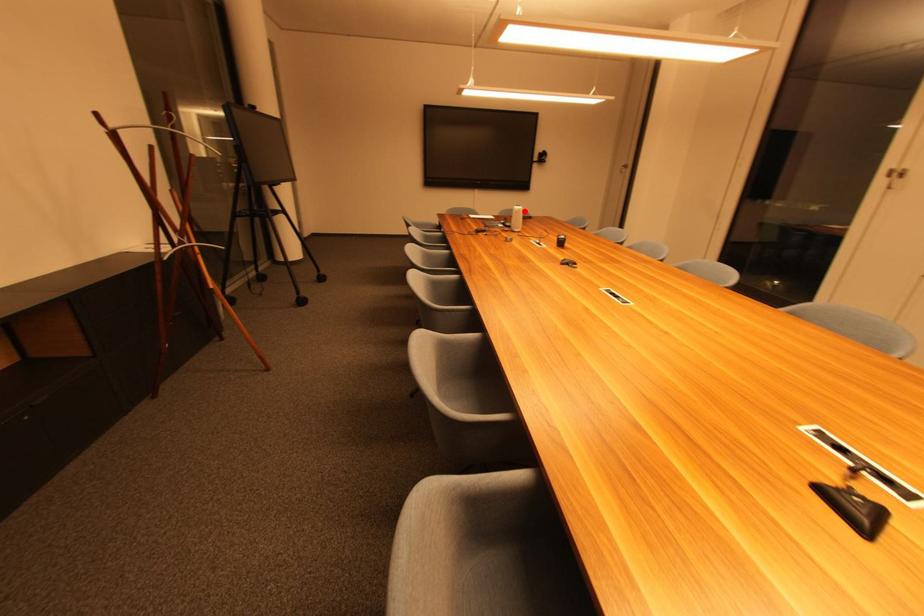
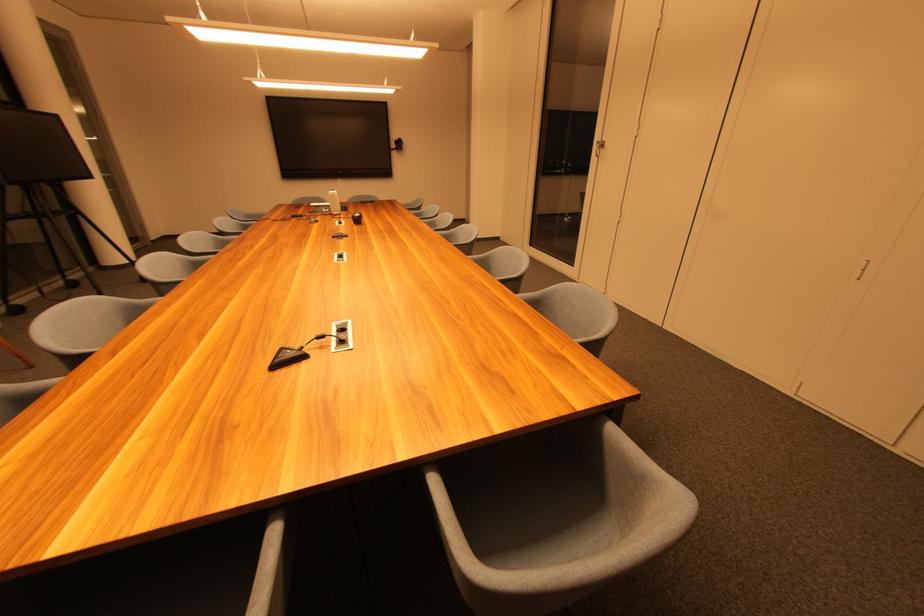
Locate, in the second image, the point that corresponds to the highlighted location in the first image.

(337, 196)